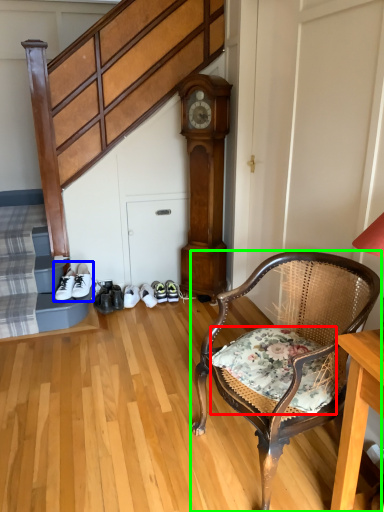
Question: Considering the real-world distances, which object is farthest from pillow (highlighted by a red box)? footwear (highlighted by a blue box) or chair (highlighted by a green box)?

Choices:
 (A) footwear
 (B) chair

Answer: (A)